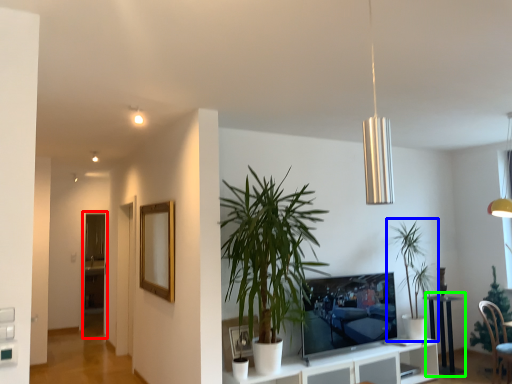
Question: Which object is the farthest from glass door (highlighted by a red box)? Choose among these: houseplant (highlighted by a blue box) or table (highlighted by a green box).

Choices:
 (A) houseplant
 (B) table

Answer: (B)